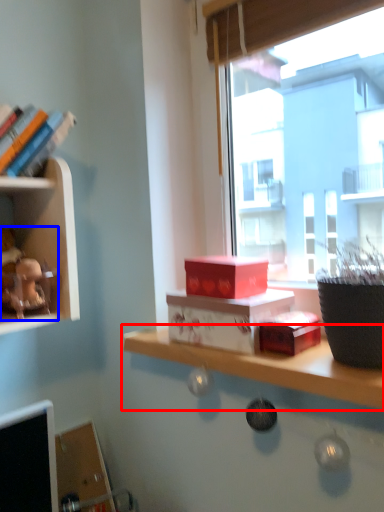
Question: Which point is closer to the camera, shelf (highlighted by a red box) or toy (highlighted by a blue box)?

Choices:
 (A) shelf
 (B) toy

Answer: (A)